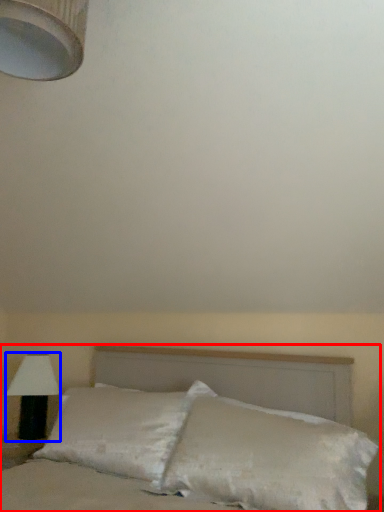
Question: Among these objects, which one is nearest to the camera, bed (highlighted by a red box) or lamp (highlighted by a blue box)?

Choices:
 (A) bed
 (B) lamp

Answer: (A)